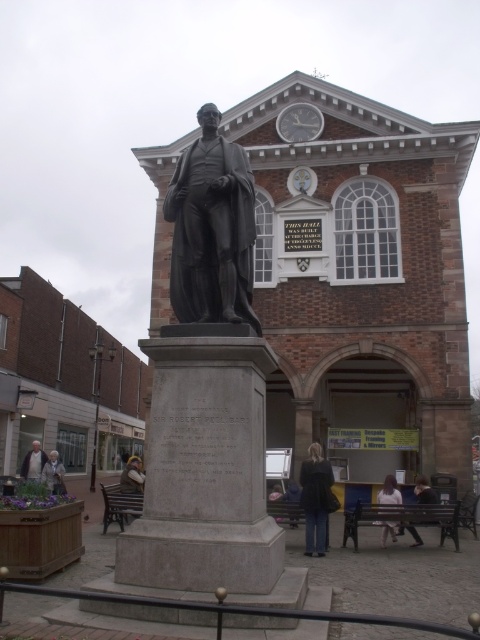
You are standing at the point with coordinates point (362, 227) and want to walk towards the point with coordinates point (59, 461). Based on the scene description, will you have an unobstructed path?

Since point (362, 227) is in front of point (59, 461), you will have an unobstructed path when walking from point (362, 227) towards point (59, 461).

You are a photographer trying to capture the statue and the historic building in a single shot. You notice the light beige fabric skirt at lower center and the light brown leather jacket at lower left in the foreground. Which object should you adjust to avoid blocking the view of the statue?

The light beige fabric skirt at lower center is positioned over the light brown leather jacket at lower left. To avoid blocking the statue, you should adjust the light beige fabric skirt at lower center since it is covering the jacket and might be closer to the camera, obstructing the view.